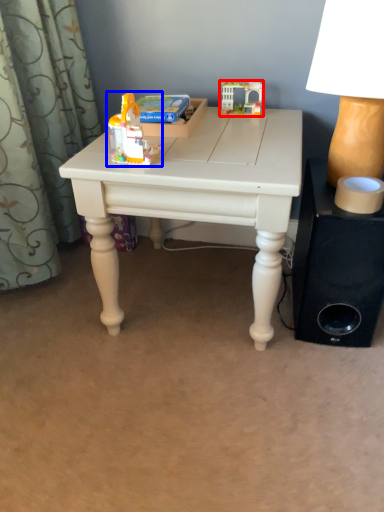
Question: Which object appears farthest to the camera in this image, toy (highlighted by a red box) or toy (highlighted by a blue box)?

Choices:
 (A) toy
 (B) toy

Answer: (A)